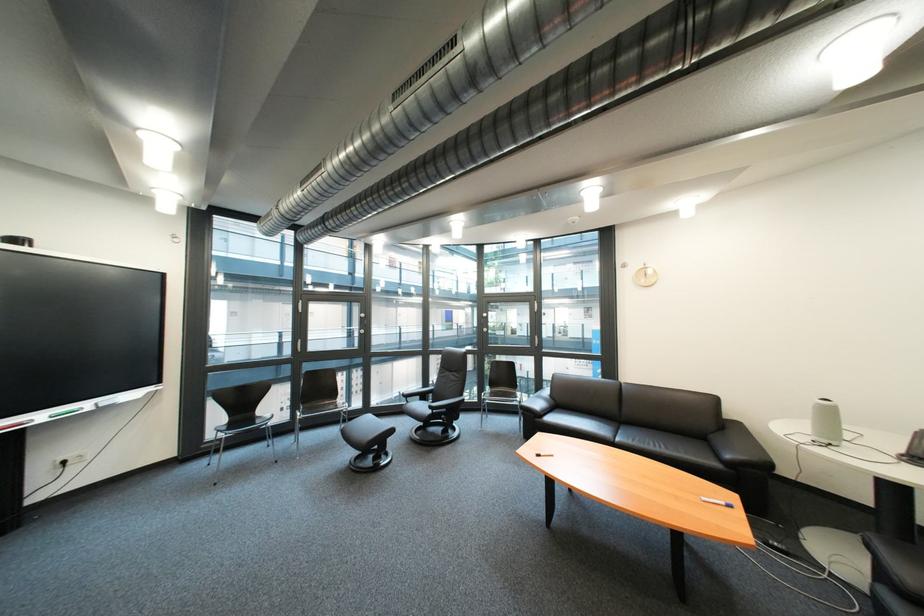
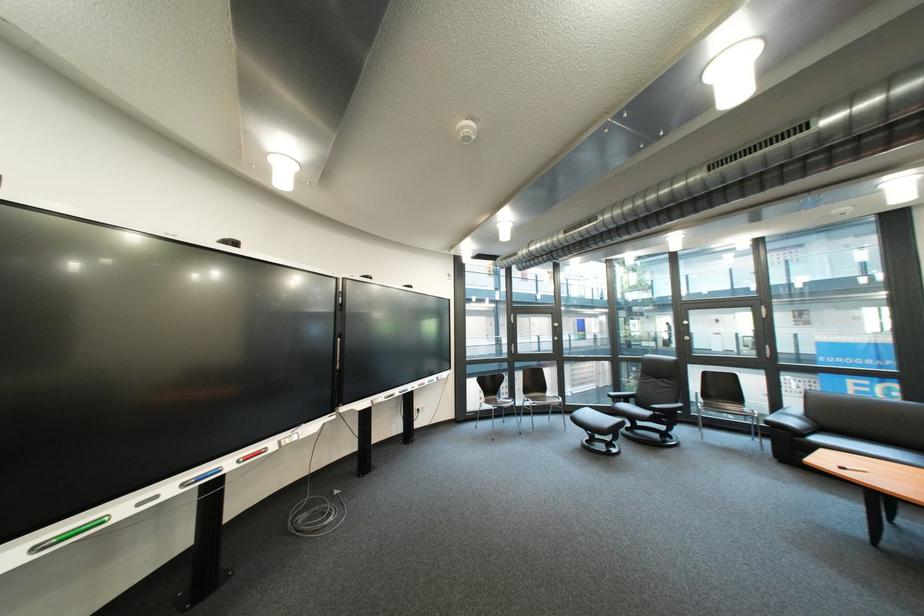
In the second image, find the point that corresponds to (371,459) in the first image.

(601, 443)